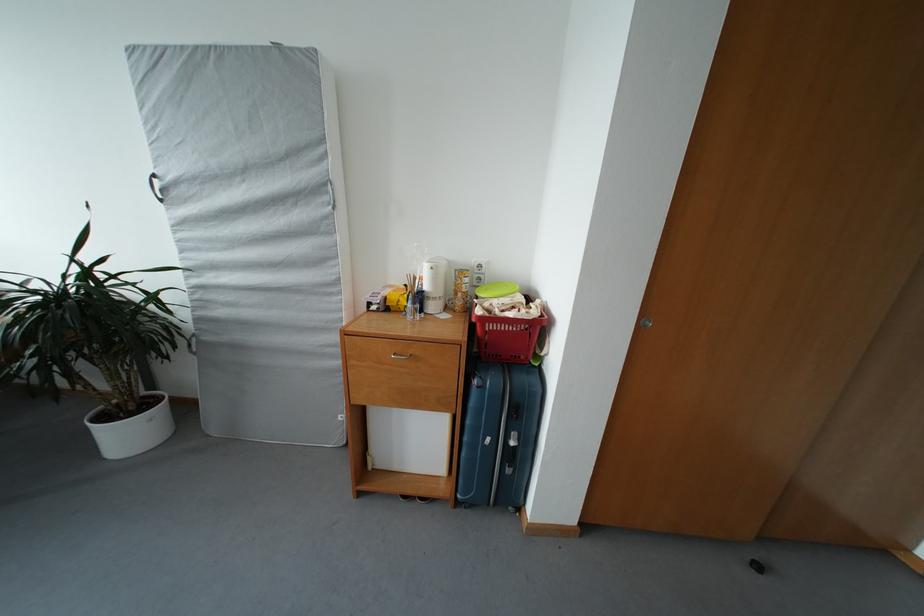
Describe the element at coordinates (495, 290) in the screenshot. The image size is (924, 616). I see `the green plastic lid` at that location.